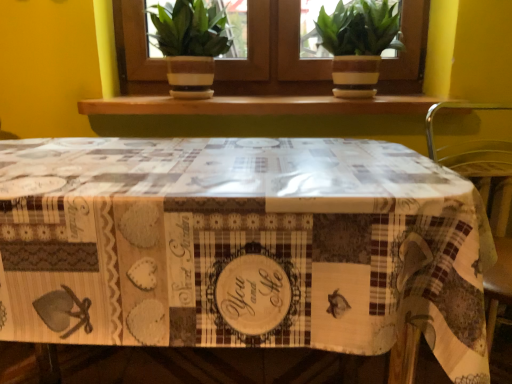
Question: From the image's perspective, is metallic green chair at right located above green leafy plant at upper center?

Choices:
 (A) yes
 (B) no

Answer: (B)

Question: From the image's perspective, does metallic green chair at right appear lower than green leafy plant at upper center?

Choices:
 (A) no
 (B) yes

Answer: (B)

Question: Would you say metallic green chair at right is a long distance from green leafy plant at upper center?

Choices:
 (A) no
 (B) yes

Answer: (A)

Question: Considering the relative sizes of metallic green chair at right and green leafy plant at upper center in the image provided, is metallic green chair at right bigger than green leafy plant at upper center?

Choices:
 (A) no
 (B) yes

Answer: (B)

Question: Is metallic green chair at right further to camera compared to green leafy plant at upper center?

Choices:
 (A) yes
 (B) no

Answer: (B)

Question: From the image's perspective, is green matte houseplant at upper center, which is the 2th houseplant from left to right, located above or below metallic green chair at right?

Choices:
 (A) below
 (B) above

Answer: (B)

Question: Does point (355, 64) appear closer or farther from the camera than point (489, 177)?

Choices:
 (A) farther
 (B) closer

Answer: (B)

Question: In terms of width, does green matte houseplant at upper center, which is the 2th houseplant from left to right, look wider or thinner when compared to metallic green chair at right?

Choices:
 (A) thin
 (B) wide

Answer: (A)

Question: Is green matte houseplant at upper center, which is the 2th houseplant from left to right, situated inside metallic green chair at right or outside?

Choices:
 (A) outside
 (B) inside

Answer: (A)

Question: In terms of width, does green leafy plant at upper center look wider or thinner when compared to printed fabric tablecloth at center?

Choices:
 (A) wide
 (B) thin

Answer: (B)

Question: Visually, is green leafy plant at upper center positioned to the left or to the right of printed fabric tablecloth at center?

Choices:
 (A) right
 (B) left

Answer: (A)

Question: In terms of size, does green leafy plant at upper center appear bigger or smaller than printed fabric tablecloth at center?

Choices:
 (A) big
 (B) small

Answer: (B)

Question: From the image's perspective, is green leafy plant at upper center located above or below printed fabric tablecloth at center?

Choices:
 (A) above
 (B) below

Answer: (A)

Question: Considering the positions of green matte houseplant at upper center, which is the 1th houseplant from right to left, and green leafy plant at upper center in the image, is green matte houseplant at upper center, which is the 1th houseplant from right to left, wider or thinner than green leafy plant at upper center?

Choices:
 (A) wide
 (B) thin

Answer: (A)

Question: Is green matte houseplant at upper center, which is the 2th houseplant from left to right, in front of or behind green leafy plant at upper center in the image?

Choices:
 (A) front
 (B) behind

Answer: (A)